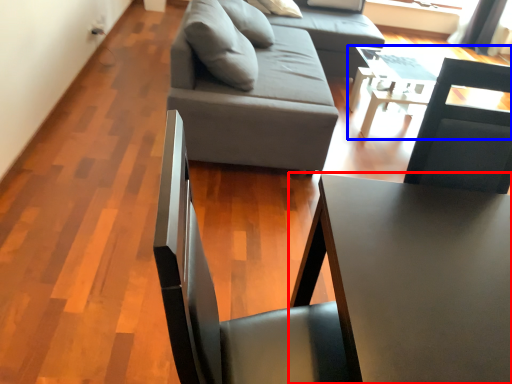
Question: Among these objects, which one is nearest to the camera, table (highlighted by a red box) or table (highlighted by a blue box)?

Choices:
 (A) table
 (B) table

Answer: (A)